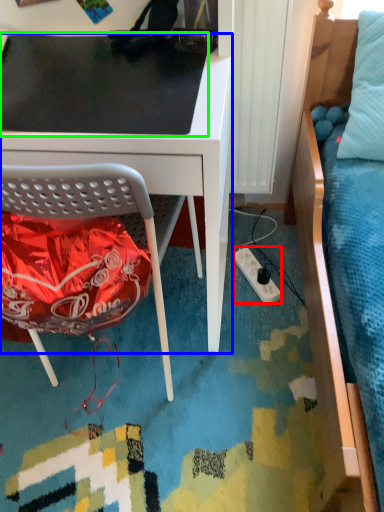
Question: Which object is the farthest from power outlet (highlighted by a red box)? Choose among these: desk (highlighted by a blue box) or table top (highlighted by a green box).

Choices:
 (A) desk
 (B) table top

Answer: (B)